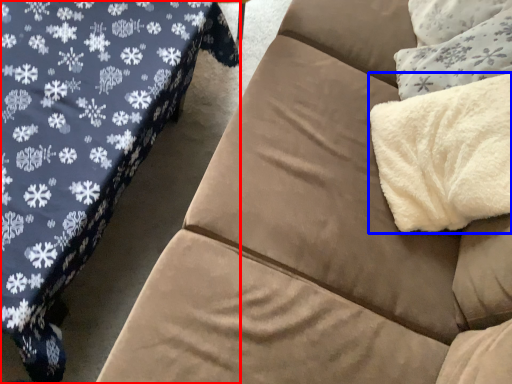
Question: Which object is further to the camera taking this photo, studio couch (highlighted by a red box) or blanket (highlighted by a blue box)?

Choices:
 (A) studio couch
 (B) blanket

Answer: (B)